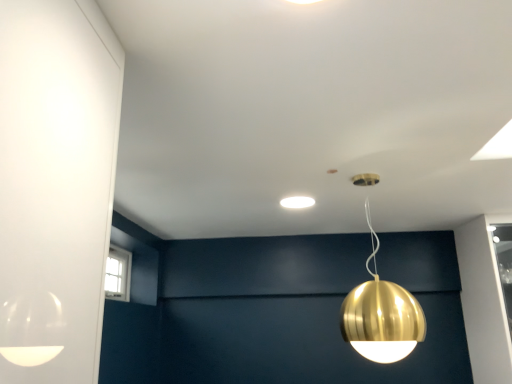
Question: Considering their positions, is gold metallic sphere at upper center, the second lamp from the top, located in front of or behind white matte light fixture at center, arranged as the first lamp when viewed from the top?

Choices:
 (A) front
 (B) behind

Answer: (A)

Question: From a real-world perspective, relative to white matte light fixture at center, which is the 2th lamp from front to back, is gold metallic sphere at upper center, which is the 2th lamp in back-to-front order, vertically above or below?

Choices:
 (A) below
 (B) above

Answer: (A)

Question: In the image, is gold metallic sphere at upper center, positioned as the 1th lamp in right-to-left order, on the left side or the right side of white matte light fixture at center, arranged as the first lamp when viewed from the top?

Choices:
 (A) left
 (B) right

Answer: (B)

Question: Considering the positions of white matte light fixture at center, which is counted as the 1th lamp, starting from the back, and gold metallic sphere at upper center, which is the 2th lamp in back-to-front order, in the image, is white matte light fixture at center, which is counted as the 1th lamp, starting from the back, taller or shorter than gold metallic sphere at upper center, which is the 2th lamp in back-to-front order,?

Choices:
 (A) short
 (B) tall

Answer: (A)

Question: In terms of width, does white matte light fixture at center, which is counted as the 1th lamp, starting from the back, look wider or thinner when compared to gold metallic sphere at upper center, arranged as the 2th lamp when viewed from the left?

Choices:
 (A) wide
 (B) thin

Answer: (B)

Question: Which is correct: white matte light fixture at center, which is counted as the 1th lamp, starting from the back, is inside gold metallic sphere at upper center, arranged as the 2th lamp when viewed from the left, or outside of it?

Choices:
 (A) inside
 (B) outside

Answer: (B)

Question: Is point (297, 198) closer or farther from the camera than point (376, 278)?

Choices:
 (A) farther
 (B) closer

Answer: (A)